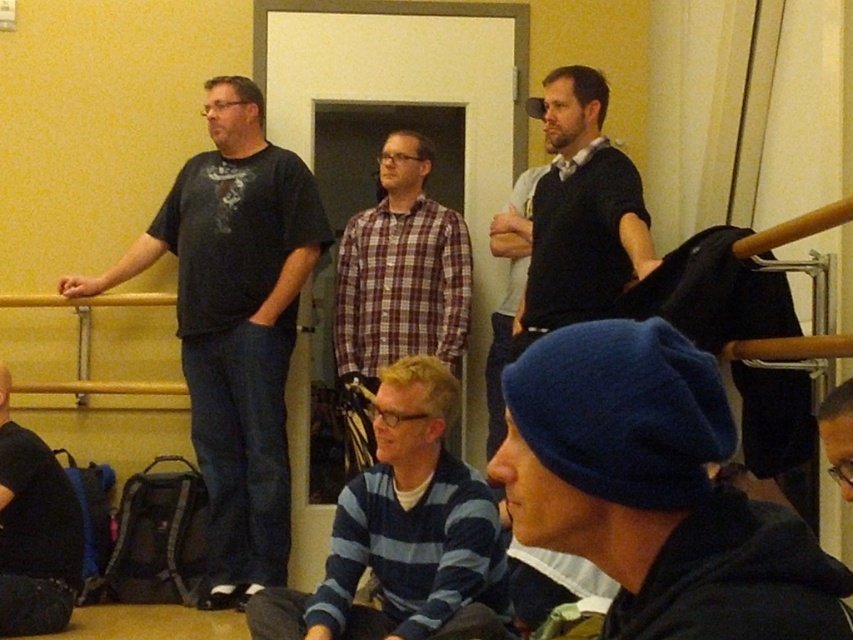
Who is positioned more to the left, dark blue t-shirt at left or blue striped sweater at center?

Positioned to the left is dark blue t-shirt at left.

Is point (231, 339) positioned after point (289, 632)?

That is True.

Does point (254, 349) come behind point (335, 529)?

Yes, point (254, 349) is behind point (335, 529).

Find the location of `dark blue t-shirt at left`. dark blue t-shirt at left is located at coordinates (235, 323).

Locate an element on the screen. This screenshot has height=640, width=853. blue striped sweater at center is located at coordinates (404, 532).

Does point (305, 621) come in front of point (386, 292)?

Yes, it is.

Describe the element at coordinates (404, 532) in the screenshot. This screenshot has width=853, height=640. I see `blue striped sweater at center` at that location.

Find the location of a particular element. The height and width of the screenshot is (640, 853). blue striped sweater at center is located at coordinates click(404, 532).

Between dark gray sweater at upper right and blue knit cap at lower left, which one has more height?

dark gray sweater at upper right is taller.

Can you confirm if dark gray sweater at upper right is bigger than blue knit cap at lower left?

Indeed, dark gray sweater at upper right has a larger size compared to blue knit cap at lower left.

Where is `dark gray sweater at upper right`? The height and width of the screenshot is (640, 853). dark gray sweater at upper right is located at coordinates (581, 212).

At what (x,y) coordinates should I click in order to perform the action: click on dark gray sweater at upper right. Please return your answer as a coordinate pair (x, y). Looking at the image, I should click on (581, 212).